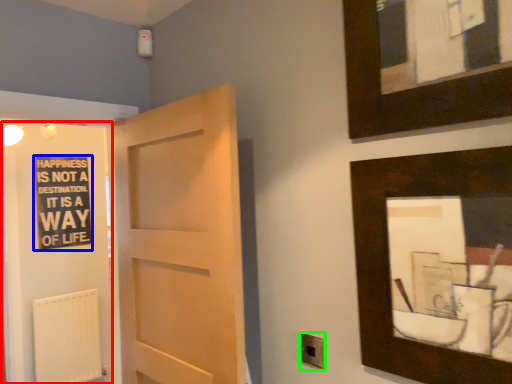
Question: Which object is positioned closest to elevator (highlighted by a red box)? Select from bulletin board (highlighted by a blue box) and electric outlet (highlighted by a green box).

Choices:
 (A) bulletin board
 (B) electric outlet

Answer: (A)